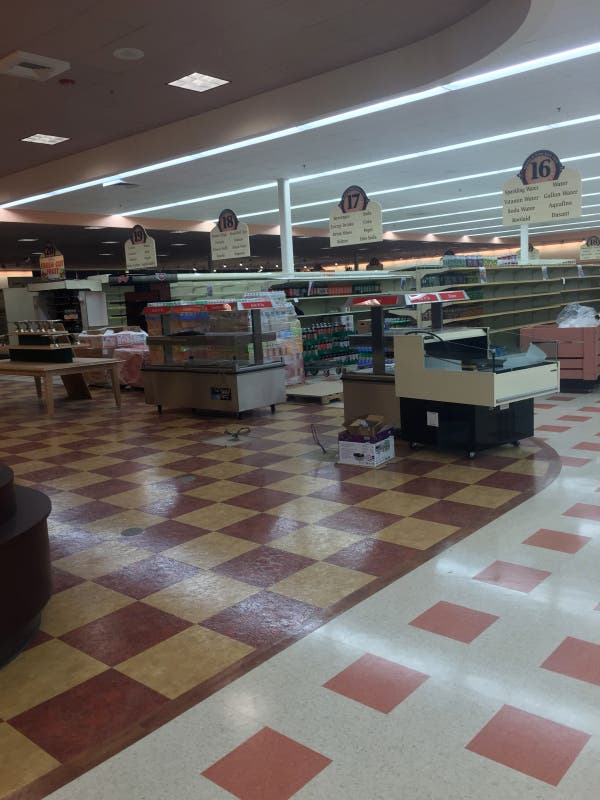
This screenshot has width=600, height=800. What are the coordinates of `box` in the screenshot? It's located at (354, 457).